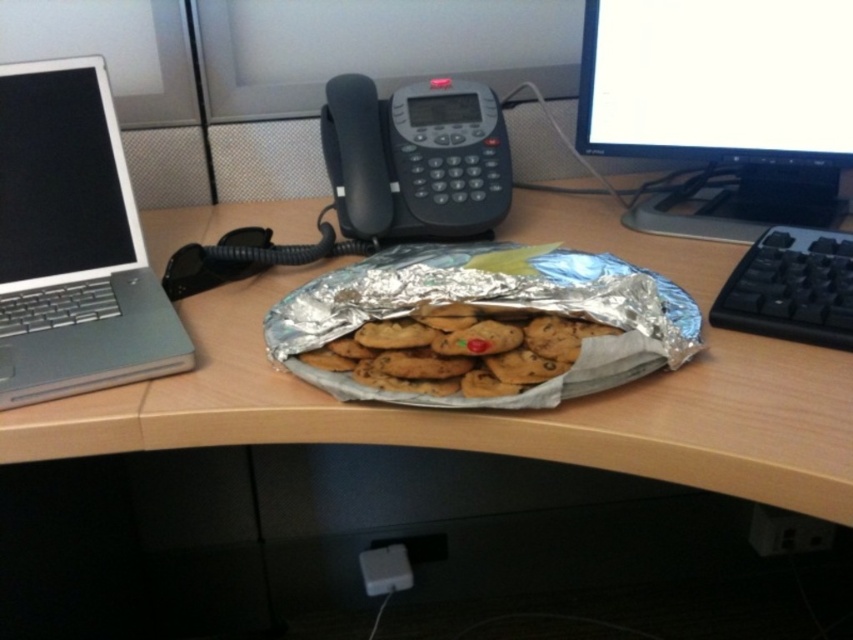
Question: Considering the relative positions of matte black monitor at upper right and golden brown cookie dough at center in the image provided, where is matte black monitor at upper right located with respect to golden brown cookie dough at center?

Choices:
 (A) below
 (B) above

Answer: (B)

Question: Estimate the real-world distances between objects in this image. Which object is farther from the sleek silver laptop at left?

Choices:
 (A) golden brown cookie dough at center
 (B) matte black monitor at upper right

Answer: (B)

Question: Which object is the closest to the golden brown cookie dough at center?

Choices:
 (A) matte black monitor at upper right
 (B) sleek silver laptop at left
 (C) wooden desk at center
 (D) black plastic keyboard at right

Answer: (C)

Question: Which object is positioned closest to the black plastic keyboard at right?

Choices:
 (A) sleek silver laptop at left
 (B) black plastic telephone at center
 (C) matte black monitor at upper right

Answer: (C)

Question: Does wooden desk at center have a larger size compared to black plastic keyboard at right?

Choices:
 (A) no
 (B) yes

Answer: (B)

Question: Is matte black monitor at upper right wider than sleek silver laptop at left?

Choices:
 (A) no
 (B) yes

Answer: (B)